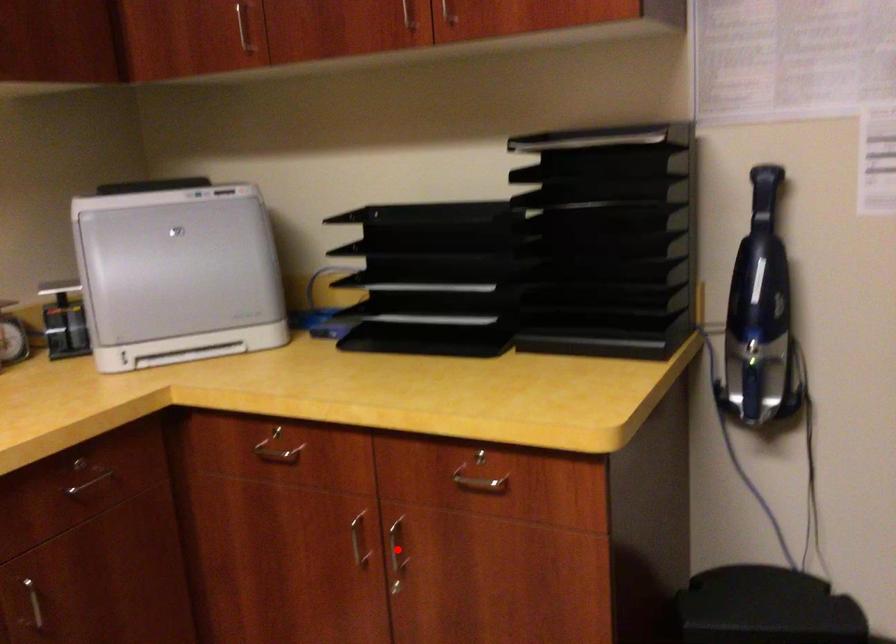
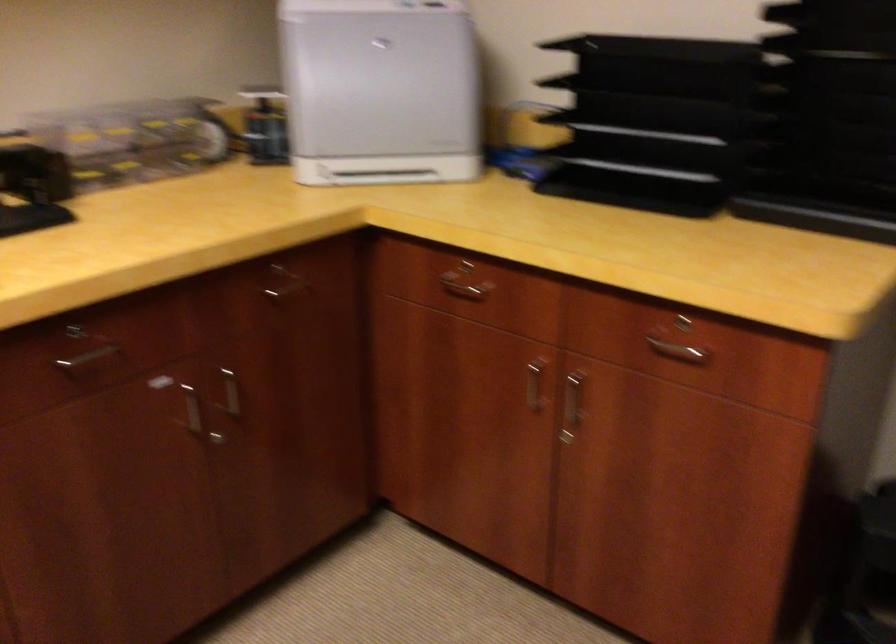
Question: I am providing you with two images of the same scene from different viewpoints. A red point is marked on the first image. Is the red point's position out of view in image 2?

Choices:
 (A) Yes
 (B) No

Answer: (B)